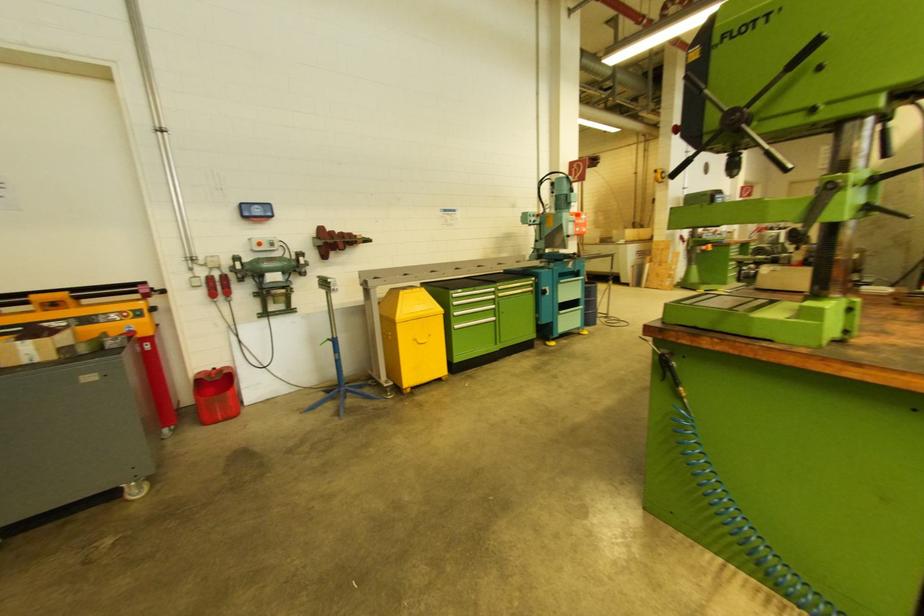
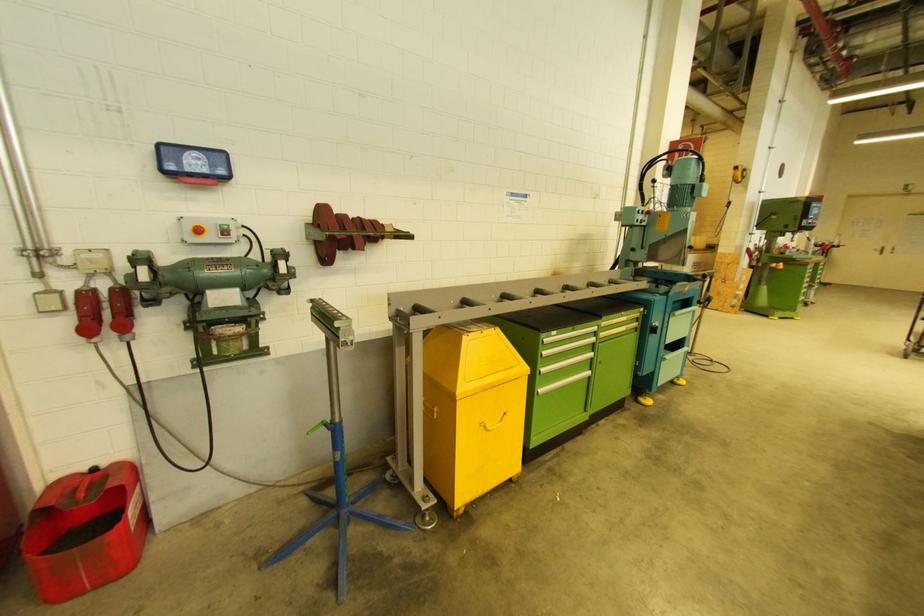
In a continuous first-person perspective shot, in which direction is the camera moving?

The movement direction of the cameraman is left, forward.